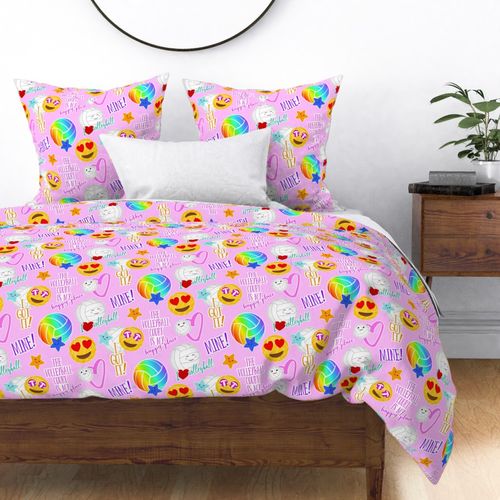
Image resolution: width=500 pixels, height=500 pixels. What are the coordinates of `decorative pillow` in the screenshot? It's located at (90, 117), (257, 119).